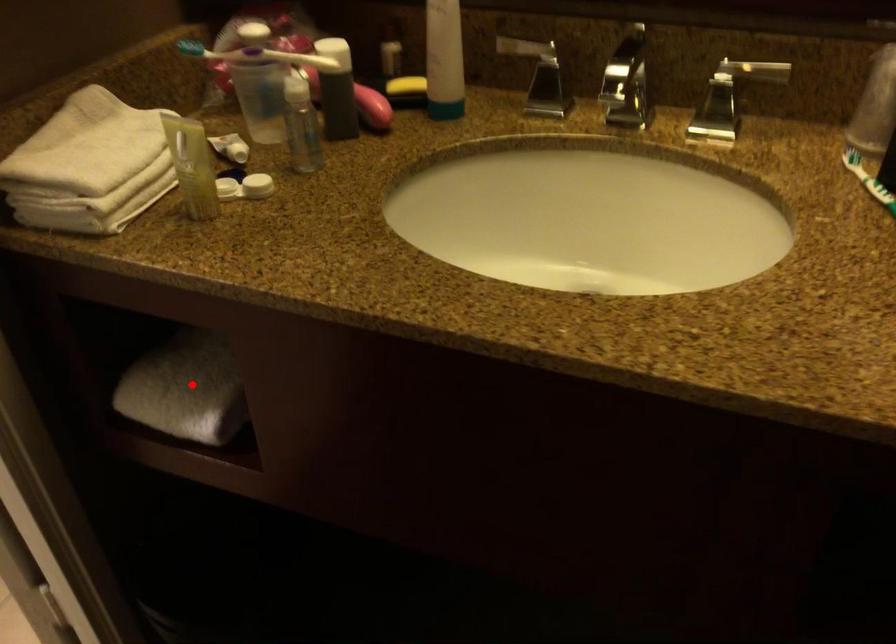
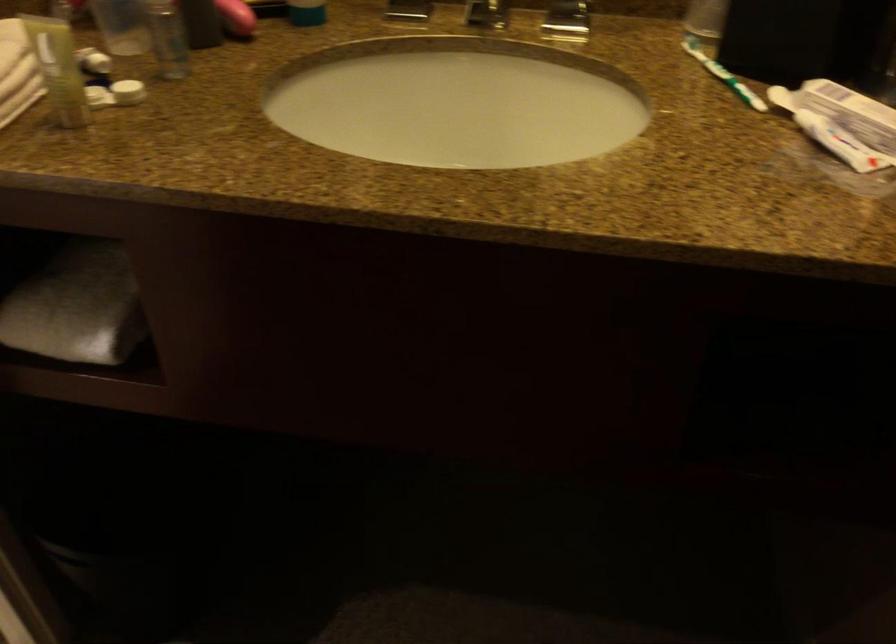
Find the pixel in the second image that matches the highlighted location in the first image.

(76, 306)